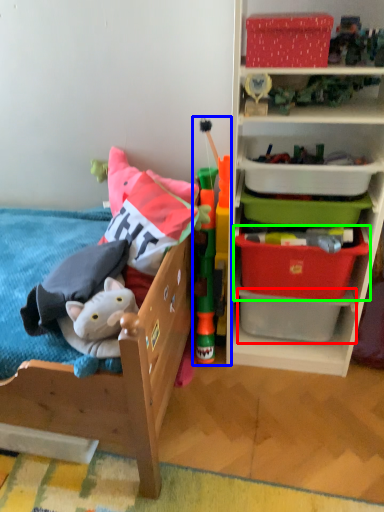
Question: Estimate the real-world distances between objects in this image. Which object is closer to storage box (highlighted by a red box), toy (highlighted by a blue box) or storage box (highlighted by a green box)?

Choices:
 (A) toy
 (B) storage box

Answer: (B)